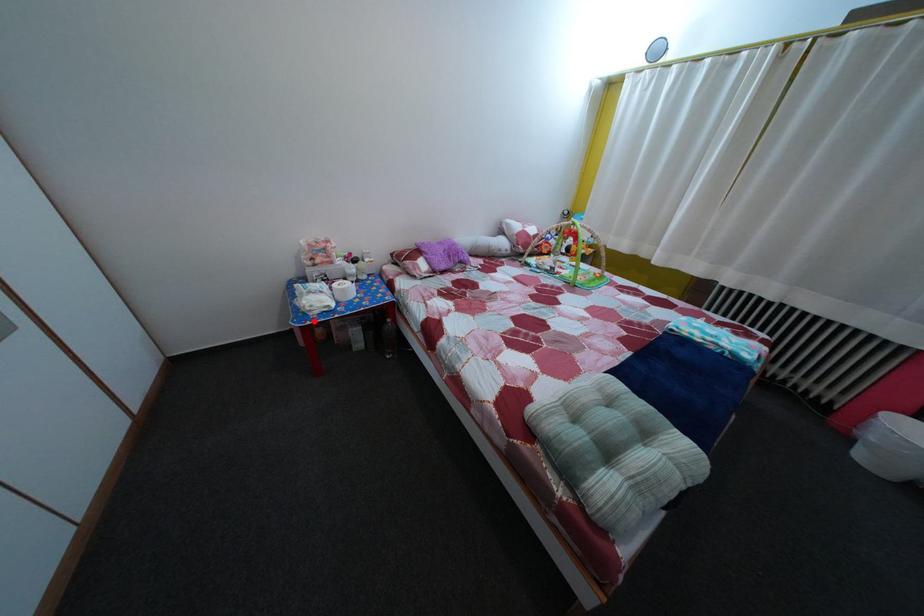
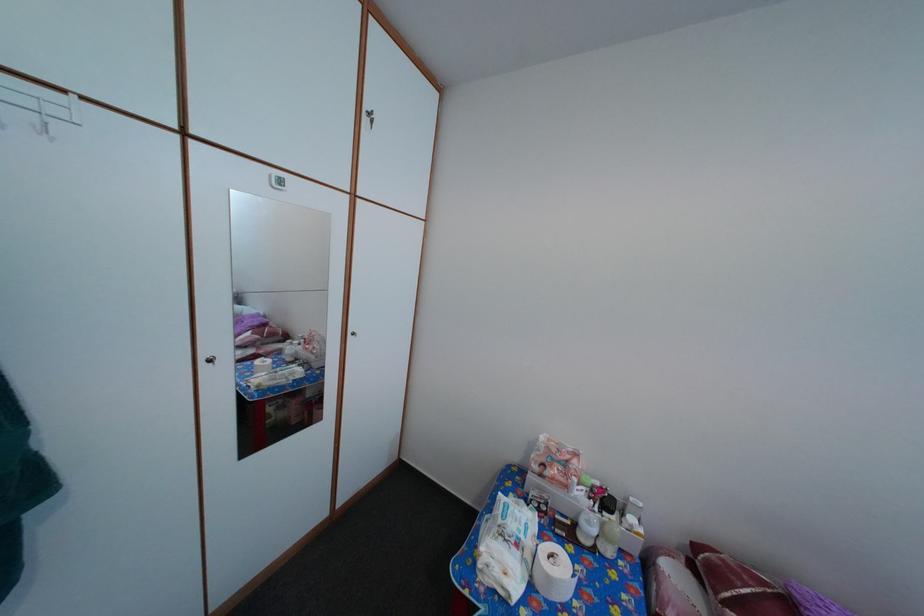
Question: I am providing you with two images of the same scene from different viewpoints. Given a red point in image1, look at the same physical point in image2. Is it:

Choices:
 (A) Closer to the viewpoint
 (B) Farther from the viewpoint

Answer: (B)